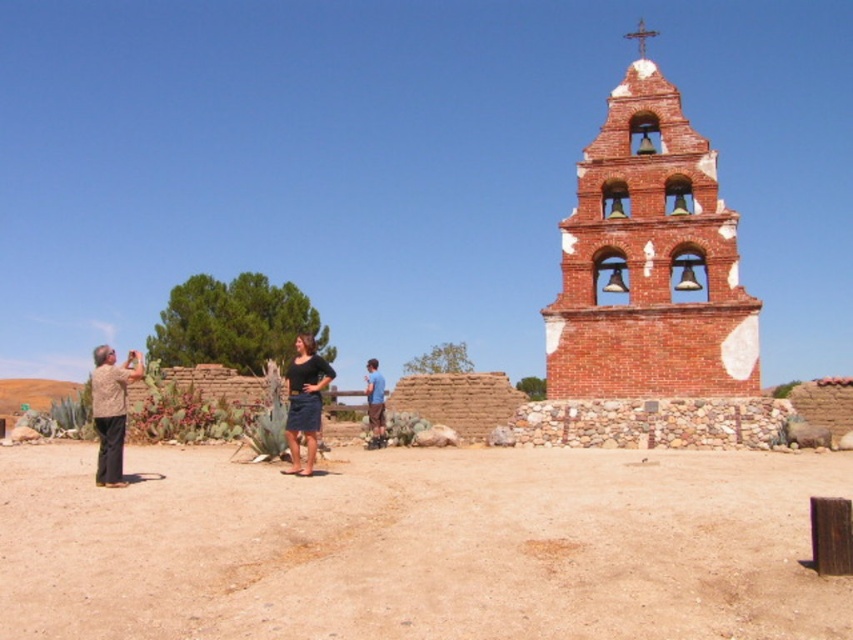
Question: Can you confirm if brown sandy dirt at lower center is thinner than dark blue denim skirt at center?

Choices:
 (A) no
 (B) yes

Answer: (A)

Question: Which of the following is the farthest from the observer?

Choices:
 (A) blue cotton shirt at center
 (B) camouflage fabric shirt at left

Answer: (A)

Question: Can you confirm if dark blue denim skirt at center is thinner than blue cotton shirt at center?

Choices:
 (A) yes
 (B) no

Answer: (B)

Question: Is brown sandy dirt at lower center in front of blue cotton shirt at center?

Choices:
 (A) no
 (B) yes

Answer: (B)

Question: Among these objects, which one is farthest from the camera?

Choices:
 (A) dark blue denim skirt at center
 (B) red brick bell tower at upper right
 (C) brown sandy dirt at lower center
 (D) camouflage fabric shirt at left

Answer: (B)

Question: Which of these objects is positioned closest to the red brick bell tower at upper right?

Choices:
 (A) camouflage fabric shirt at left
 (B) blue cotton shirt at center
 (C) brown sandy dirt at lower center
 (D) dark blue denim skirt at center

Answer: (C)